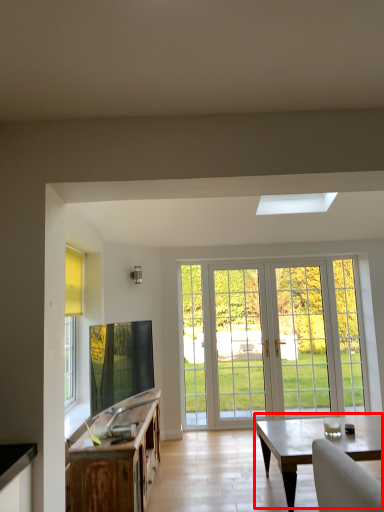
Question: From the image, what is the correct spatial relationship of coffee table (annotated by the red box) in relation to cabinetry?

Choices:
 (A) left
 (B) right

Answer: (B)